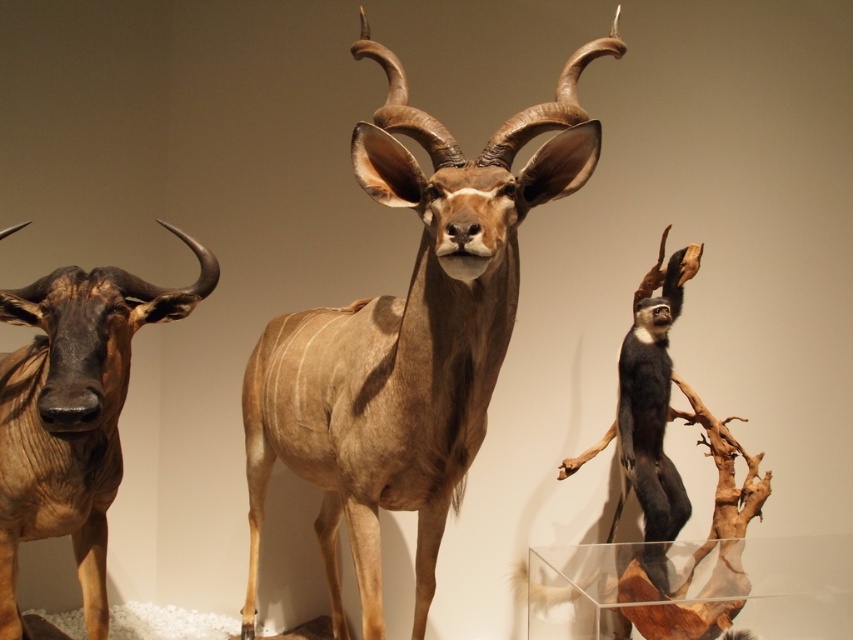
Question: Does brown matte antelope at center have a smaller size compared to brown matte antelope at left?

Choices:
 (A) yes
 (B) no

Answer: (B)

Question: Can you confirm if brown matte antelope at center is positioned below brown matte antelope at left?

Choices:
 (A) yes
 (B) no

Answer: (A)

Question: Among these points, which one is nearest to the camera?

Choices:
 (A) coord(260,461)
 (B) coord(119,289)

Answer: (B)

Question: Does brown matte antelope at center have a lesser width compared to brown matte antelope at left?

Choices:
 (A) no
 (B) yes

Answer: (A)

Question: Among these objects, which one is nearest to the camera?

Choices:
 (A) brown matte antelope at center
 (B) brown matte antelope at left

Answer: (A)

Question: Which object appears farthest from the camera in this image?

Choices:
 (A) brown matte antelope at left
 (B) brown matte antelope at center

Answer: (A)